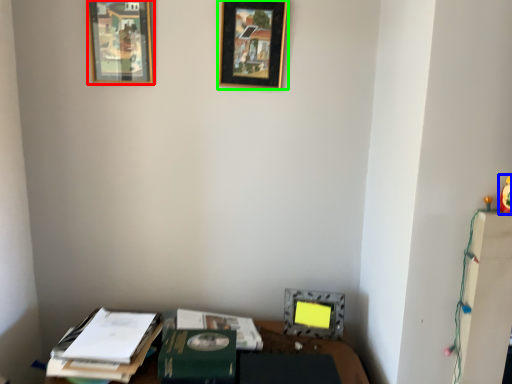
Question: Based on their relative distances, which object is nearer to picture frame (highlighted by a red box)? Choose from toy (highlighted by a blue box) and picture frame (highlighted by a green box).

Choices:
 (A) toy
 (B) picture frame

Answer: (B)